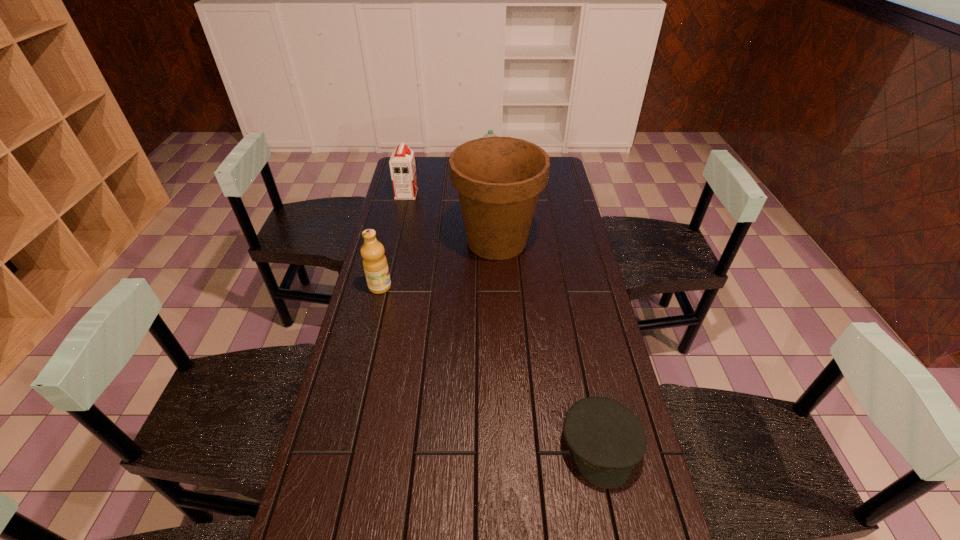
Identify the location of free space at the far right corner of the desktop. Image resolution: width=960 pixels, height=540 pixels. (556, 177).

This screenshot has width=960, height=540. Identify the location of free space between the nearest object and the farthest object. point(545,314).

Find the location of a particular element. Image resolution: width=960 pixels, height=540 pixels. vacant area that lies between the olive oil and the tallest object is located at coordinates (439, 264).

Find the location of a particular element. Image resolution: width=960 pixels, height=540 pixels. free space that is in between the tallest object and the nearest object is located at coordinates (548, 344).

Find the location of a particular element. This screenshot has width=960, height=540. free space between the shortest object and the flowerpot is located at coordinates (548, 344).

Locate an element on the screen. The image size is (960, 540). vacant area that lies between the soya milk and the water bottle is located at coordinates (448, 187).

Locate an element on the screen. This screenshot has height=540, width=960. unoccupied position between the third nearest object and the olive oil is located at coordinates (439, 264).

You are a GUI agent. You are given a task and a screenshot of the screen. Output one action in this format:
    pyautogui.click(x=<x>, y=<y>)
    Task: Click on the empty space that is in between the fourth farthest object and the flowerpot
    
    Given the screenshot: What is the action you would take?
    pyautogui.click(x=439, y=264)

Where is `free area in between the second nearest object and the shortest object`? This screenshot has height=540, width=960. free area in between the second nearest object and the shortest object is located at coordinates (490, 367).

Identify the location of vacant space that's between the second nearest object and the tallest object. (439, 264).